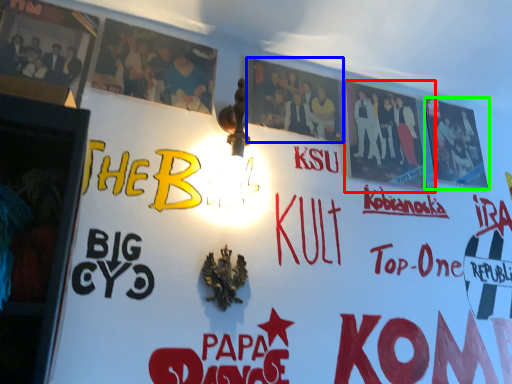
Question: Considering the real-world distances, which object is closest to poster (highlighted by a red box)? poster (highlighted by a blue box) or poster (highlighted by a green box).

Choices:
 (A) poster
 (B) poster

Answer: (B)